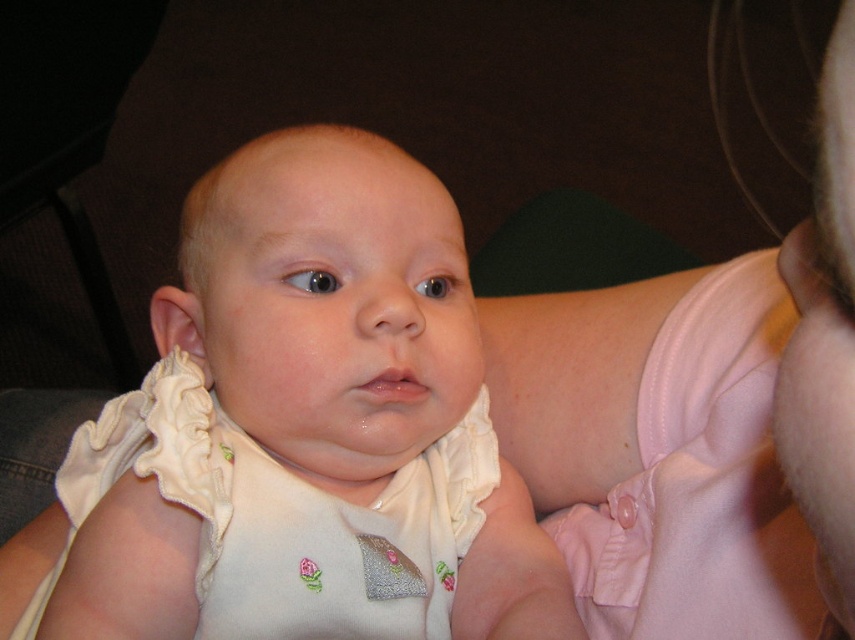
Consider the image. You are a photographer adjusting the lighting for a baby photo session. You have the white soft fabric baby at center and the white ruffled bib at center in your frame. Since both are white, you need to ensure proper exposure. Which object should you focus on first to adjust the exposure, considering their sizes?

The white soft fabric baby at center is taller than the white ruffled bib at center, so you should focus on adjusting the exposure for the white soft fabric baby at center first because it is larger and will require more precise lighting adjustments to capture details properly.

You are holding a baby and want to place a small toy 12 inches away from the baby. If the point where the baby is located is at point (437, 449), which is 22 inches from you, can you place the toy within the same space?

The point (437, 449) is 22 inches from the viewer. To place the toy 12 inches away from the baby, it would need to be placed at 22 inches minus 12 inches equals 10 inches from the viewer. Since the space allows for positioning within 22 inches, the toy can be placed 10 inches away from you, which is within the same space.

You are a photographer setting up for a baby photoshoot. You have a white soft fabric baby at center and a white ruffled bib at center in your frame. Since both items are white, you need to ensure they are distinguishable. Based on the scene description, which object should you adjust to make them stand out more?

The white soft fabric baby at center should be adjusted because its width is larger than the white ruffled bib at center, making it more prominent and easier to distinguish in the frame.